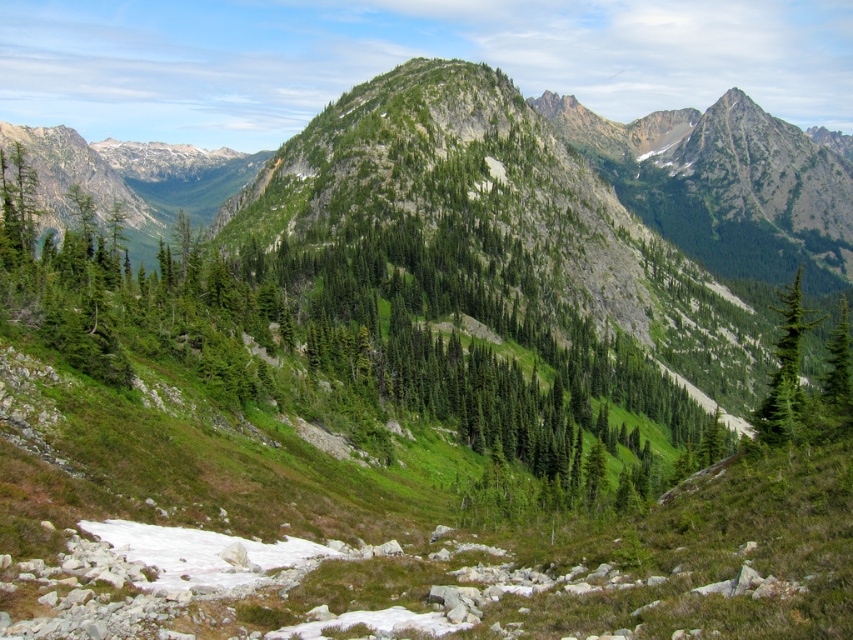
Is green textured tree at center shorter than green textured tree at right?

Incorrect, green textured tree at center's height does not fall short of green textured tree at right's.

Is green textured tree at center thinner than green textured tree at right?

No, green textured tree at center is not thinner than green textured tree at right.

Is point (238, 348) farther from viewer compared to point (791, 316)?

Yes, point (238, 348) is behind point (791, 316).

The width and height of the screenshot is (853, 640). I want to click on green textured tree at center, so click(357, 337).

Where is `green textured tree at center`? green textured tree at center is located at coordinates (357, 337).

Is the position of green textured tree at center more distant than that of green matte tree at right?

Yes, green textured tree at center is behind green matte tree at right.

Between point (521, 340) and point (846, 339), which one is positioned behind?

Point (521, 340)

Locate an element on the screen. The height and width of the screenshot is (640, 853). green textured tree at center is located at coordinates (357, 337).

Can you confirm if green textured tree at right is shorter than green matte tree at right?

No.

Between point (801, 310) and point (844, 337), which one is positioned behind?

The point (801, 310) is more distant.

Identify the location of green textured tree at right. (785, 371).